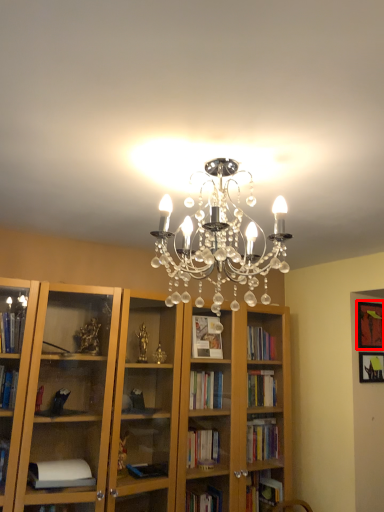
Question: In this image, where is picture frame (annotated by the red box) located relative to picture frame?

Choices:
 (A) right
 (B) left

Answer: (A)